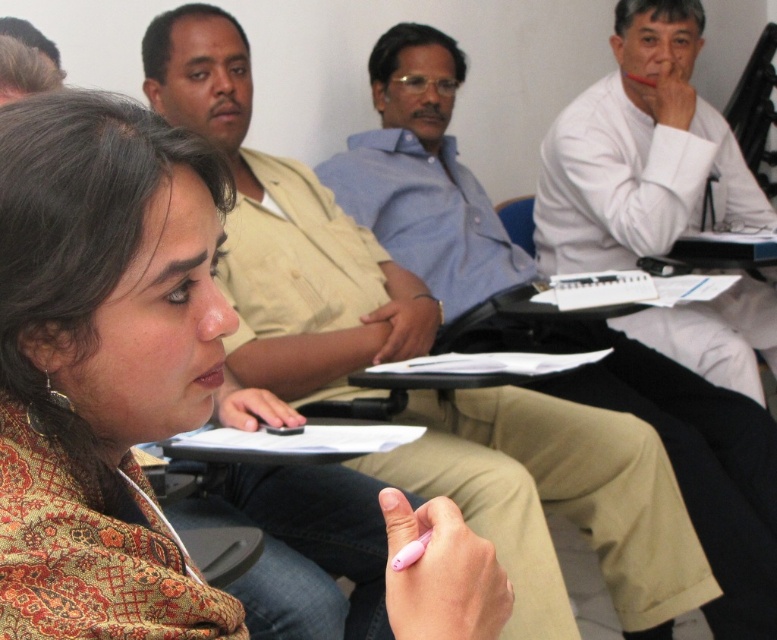
Question: Can you confirm if blue shirt at upper center is positioned below blue fabric chair at center?

Choices:
 (A) yes
 (B) no

Answer: (A)

Question: Which point is closer to the camera?

Choices:
 (A) (145, 298)
 (B) (525, 228)
 (C) (650, 150)

Answer: (A)

Question: Which of the following is the closest to the observer?

Choices:
 (A) (591, 396)
 (B) (511, 237)

Answer: (A)

Question: Does white smooth shirt at upper right have a lesser width compared to blue fabric chair at center?

Choices:
 (A) yes
 (B) no

Answer: (B)

Question: Does patterned fabric jacket at center appear under blue shirt at upper center?

Choices:
 (A) no
 (B) yes

Answer: (B)

Question: Which is nearer to the patterned fabric jacket at center?

Choices:
 (A) blue shirt at upper center
 (B) white smooth shirt at upper right

Answer: (A)